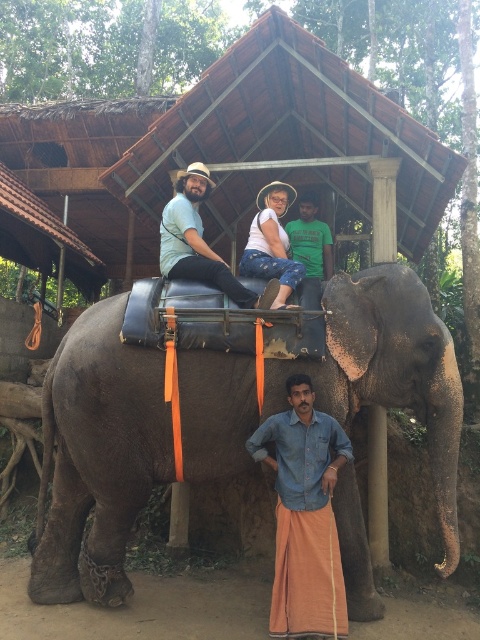
Is gray textured elephant at center to the right of brown thatched roof at upper center from the viewer's perspective?

In fact, gray textured elephant at center is to the left of brown thatched roof at upper center.

In the scene shown: Between gray textured elephant at center and brown thatched roof at upper center, which one is positioned lower?

gray textured elephant at center is lower down.

Is point (78, 506) behind point (371, 173)?

No, (78, 506) is in front of (371, 173).

I want to click on gray textured elephant at center, so (98, 456).

Does brown thatched roof at upper center lie in front of denim pants at center?

No, brown thatched roof at upper center is behind denim pants at center.

Looking at this image, is brown thatched roof at upper center thinner than denim pants at center?

Incorrect, brown thatched roof at upper center's width is not less than denim pants at center's.

The height and width of the screenshot is (640, 480). Describe the element at coordinates (288, 138) in the screenshot. I see `brown thatched roof at upper center` at that location.

Find the location of a particular element. brown thatched roof at upper center is located at coordinates (288, 138).

Does brown thatched roof at upper center appear on the left side of matte teal shirt at center?

Incorrect, brown thatched roof at upper center is not on the left side of matte teal shirt at center.

Who is shorter, brown thatched roof at upper center or matte teal shirt at center?

matte teal shirt at center is shorter.

Find the location of `brown thatched roof at upper center`. brown thatched roof at upper center is located at coordinates (288, 138).